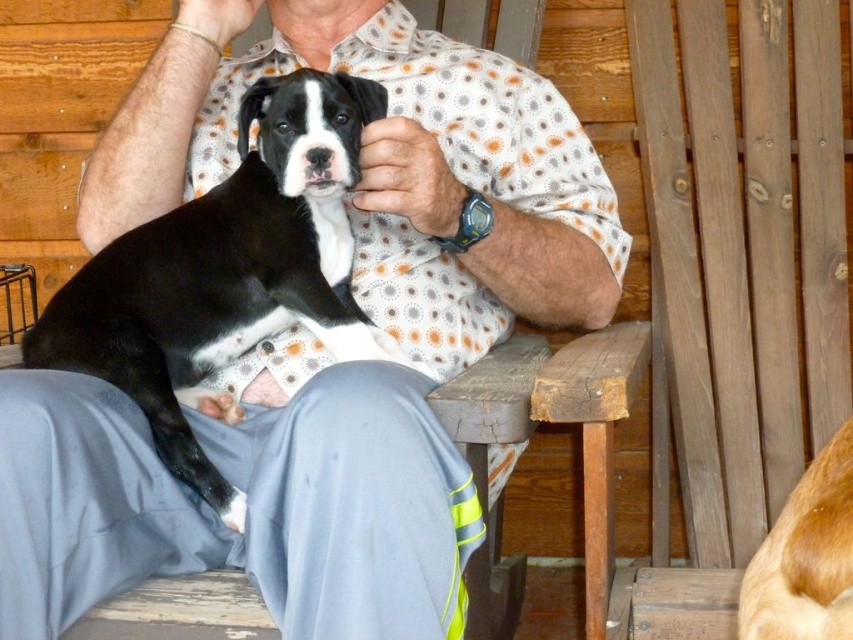
You are standing in front of the wooden slats chair at right and the black smooth fur at center. Which object is closer to you?

The wooden slats chair at right is closer to you because it is further to the viewer than the black smooth fur at center.

Where is the black smooth fur at center located in the image?

The black smooth fur at center is located at point 0.425 in the x coordinate and 0.267 in the y coordinate.

You are a fashion designer observing the scene. You notice the matte black shirt at center and the black smooth fur at center. Which one is positioned more to the right side?

The matte black shirt at center is positioned to the right of the black smooth fur at center, so the matte black shirt at center is more to the right side.